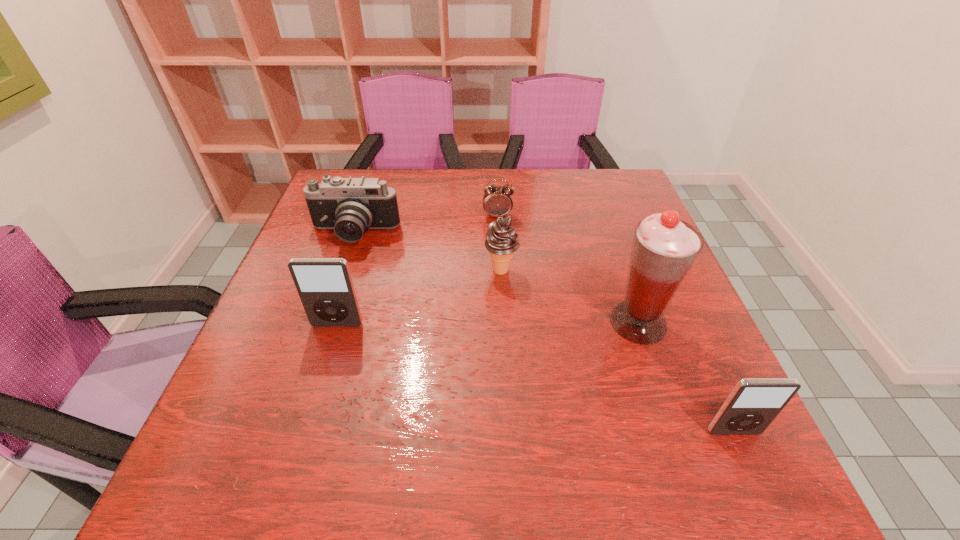
At what (x,y) coordinates should I click in order to perform the action: click on the taller iPod. Please return your answer as a coordinate pair (x, y). The image size is (960, 540). Looking at the image, I should click on (325, 287).

Where is `the farther iPod`? the farther iPod is located at coordinates 325,287.

Where is `the nearer iPod`? the nearer iPod is located at coordinates (752, 405).

Identify the location of the right iPod. (752, 405).

At what (x,y) coordinates should I click in order to perform the action: click on alarm clock. Please return your answer as a coordinate pair (x, y). The height and width of the screenshot is (540, 960). Looking at the image, I should click on (497, 201).

Identify the location of the shortest object. [497, 201].

Locate an element on the screen. The image size is (960, 540). the tallest object is located at coordinates (664, 248).

Locate an element on the screen. The height and width of the screenshot is (540, 960). the fifth nearest object is located at coordinates (350, 206).

I want to click on the third farthest object, so click(502, 241).

This screenshot has height=540, width=960. In order to click on vacant space situated 0.210m on the front-facing side of the left iPod in this screenshot , I will do `click(307, 419)`.